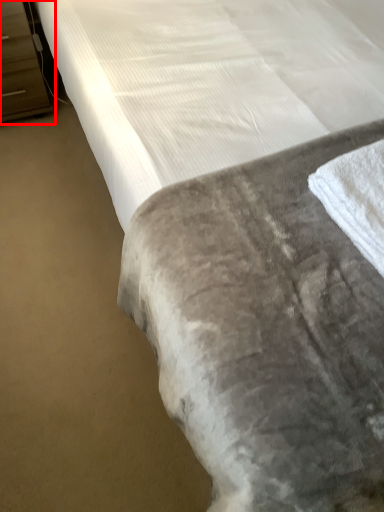
Question: From the image's perspective, what is the correct spatial relationship of dresser (annotated by the red box) in relation to bath towel?

Choices:
 (A) below
 (B) above

Answer: (B)